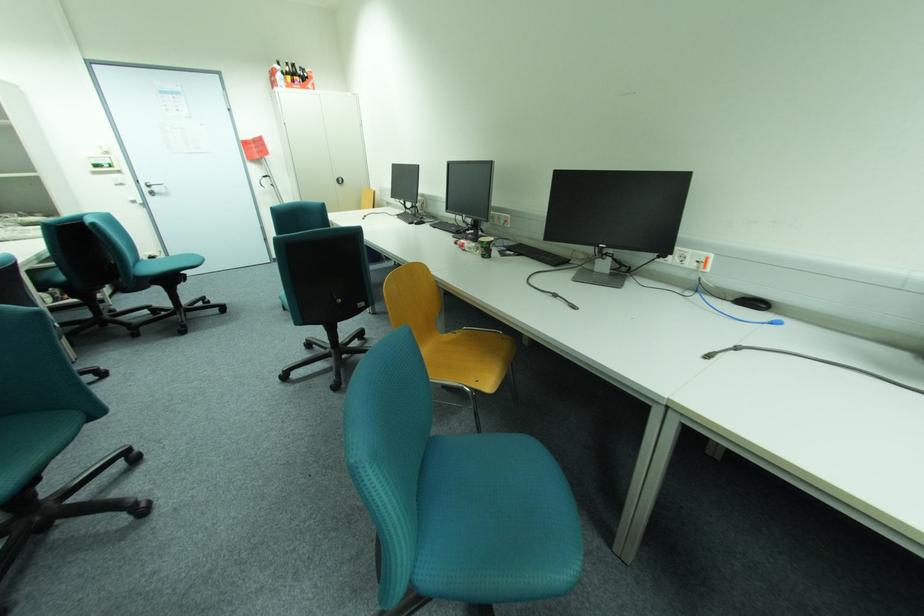
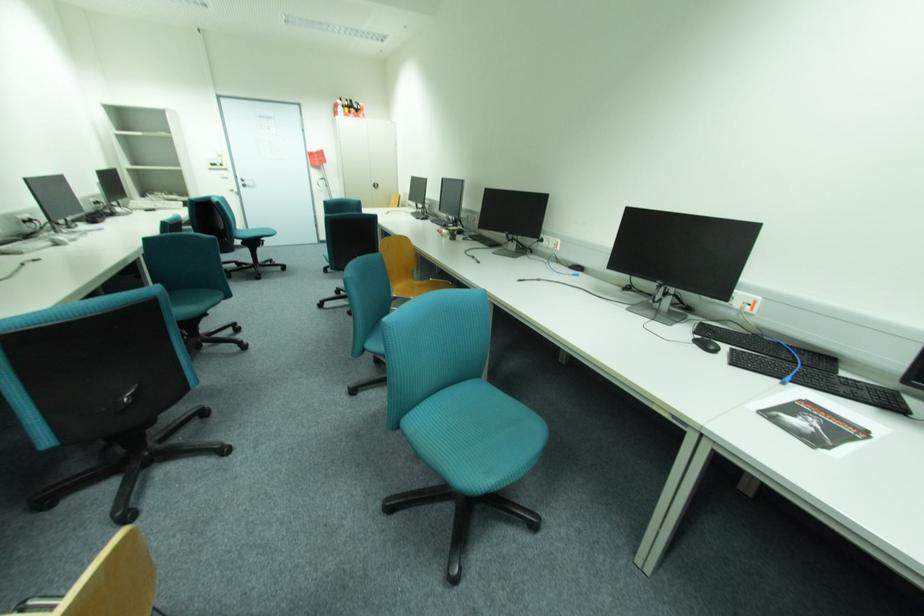
Find the pixel in the second image that matches point (162, 190) in the first image.

(253, 183)